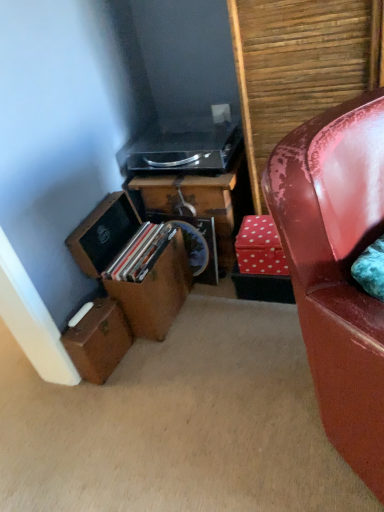
The image size is (384, 512). In order to click on shiny red leather chair at right in this screenshot , I will do `click(337, 268)`.

I want to click on black plastic stereo at upper center, so click(x=183, y=148).

This screenshot has width=384, height=512. Describe the element at coordinates (260, 247) in the screenshot. I see `red polka dot cardboard box at center` at that location.

Measure the distance between point (259, 259) and camera.

They are 5.11 feet apart.

I want to click on shiny red leather chair at right, so click(337, 268).

Locate an element on the screen. chair on the right side of red polka dot cardboard box at center is located at coordinates (337, 268).

Is red polka dot cardboard box at center located within shiny red leather chair at right?

No, red polka dot cardboard box at center is not a part of shiny red leather chair at right.

Does shiny red leather chair at right appear on the left side of red polka dot cardboard box at center?

No, shiny red leather chair at right is not to the left of red polka dot cardboard box at center.

From the image's perspective, does shiny red leather chair at right appear lower than red polka dot cardboard box at center?

Yes.

From a real-world perspective, between black plastic stereo at upper center and red polka dot cardboard box at center, who is vertically higher?

black plastic stereo at upper center is physically above.

Is black plastic stereo at upper center further to camera compared to red polka dot cardboard box at center?

That is True.

From the picture: In the image, is black plastic stereo at upper center on the left side or the right side of red polka dot cardboard box at center?

Clearly, black plastic stereo at upper center is on the left of red polka dot cardboard box at center in the image.

Locate an element on the screen. This screenshot has width=384, height=512. the 2nd box positioned below the black plastic stereo at upper center (from a real-world perspective) is located at coordinates (98, 341).

Is black plastic stereo at upper center located within brown leather suitcase at lower left, acting as the second box starting from the top?

Actually, black plastic stereo at upper center is outside brown leather suitcase at lower left, acting as the second box starting from the top.

Can you confirm if brown leather suitcase at lower left, placed as the first box when sorted from bottom to top, is smaller than black plastic stereo at upper center?

Indeed, brown leather suitcase at lower left, placed as the first box when sorted from bottom to top, has a smaller size compared to black plastic stereo at upper center.

Looking at this image, could you tell me if brown leather suitcase at lower left, placed as the first box when sorted from bottom to top, is turned towards black plastic stereo at upper center?

No, brown leather suitcase at lower left, placed as the first box when sorted from bottom to top, is not turned towards black plastic stereo at upper center.

From a real-world perspective, between wooden box at lower left, the second box positioned from the bottom, and brown leather suitcase at lower left, acting as the second box starting from the top, who is vertically lower?

brown leather suitcase at lower left, acting as the second box starting from the top, from a real-world perspective.

From the picture: Can you confirm if wooden box at lower left, the first box in the top-to-bottom sequence, is smaller than brown leather suitcase at lower left, acting as the second box starting from the top?

Actually, wooden box at lower left, the first box in the top-to-bottom sequence, might be larger than brown leather suitcase at lower left, acting as the second box starting from the top.

From the image's perspective, is wooden box at lower left, the first box in the top-to-bottom sequence, located beneath brown leather suitcase at lower left, placed as the first box when sorted from bottom to top?

No.

Can you tell me how much brown leather suitcase at lower left, placed as the first box when sorted from bottom to top, and wooden box at lower left, the second box positioned from the bottom, differ in facing direction?

They differ by 3.14 degrees in their facing directions.

Could you tell me if brown leather suitcase at lower left, placed as the first box when sorted from bottom to top, is turned towards wooden box at lower left, the first box in the top-to-bottom sequence?

No, brown leather suitcase at lower left, placed as the first box when sorted from bottom to top, does not turn towards wooden box at lower left, the first box in the top-to-bottom sequence.

Looking at this image, does brown leather suitcase at lower left, acting as the second box starting from the top, have a greater height compared to wooden box at lower left, the second box positioned from the bottom?

In fact, brown leather suitcase at lower left, acting as the second box starting from the top, may be shorter than wooden box at lower left, the second box positioned from the bottom.

Considering the sizes of objects wooden box at lower left, the second box positioned from the bottom, and shiny red leather chair at right in the image provided, who is wider, wooden box at lower left, the second box positioned from the bottom, or shiny red leather chair at right?

With larger width is shiny red leather chair at right.

From the image's perspective, is wooden box at lower left, the first box in the top-to-bottom sequence, located above or below shiny red leather chair at right?

Clearly, from the image's perspective, wooden box at lower left, the first box in the top-to-bottom sequence, is above shiny red leather chair at right.

Which object is positioned more to the right, wooden box at lower left, the first box in the top-to-bottom sequence, or shiny red leather chair at right?

From the viewer's perspective, shiny red leather chair at right appears more on the right side.

Is black plastic stereo at upper center aimed at brown leather suitcase at lower left, acting as the second box starting from the top?

No, black plastic stereo at upper center is not oriented towards brown leather suitcase at lower left, acting as the second box starting from the top.

Based on their positions, is black plastic stereo at upper center located to the left or right of brown leather suitcase at lower left, acting as the second box starting from the top?

black plastic stereo at upper center is positioned on brown leather suitcase at lower left, acting as the second box starting from the top,'s right side.

From a real-world perspective, which object rests below the other?

brown leather suitcase at lower left, acting as the second box starting from the top, from a real-world perspective.

Which is closer to the camera, (142, 152) or (104, 298)?

Positioned in front is point (104, 298).

The image size is (384, 512). Identify the location of cardboard box located above the shiny red leather chair at right (from the image's perspective). [260, 247].

The width and height of the screenshot is (384, 512). Identify the location of stereo located behind the red polka dot cardboard box at center. (183, 148).

From the image, which object appears to be nearer to red polka dot cardboard box at center, brown leather suitcase at lower left, acting as the second box starting from the top, or shiny red leather chair at right?

The object closer to red polka dot cardboard box at center is brown leather suitcase at lower left, acting as the second box starting from the top.

Which object lies nearer to the anchor point black plastic stereo at upper center, wooden desk at center or shiny red leather chair at right?

wooden desk at center lies closer to black plastic stereo at upper center than the other object.

Estimate the real-world distances between objects in this image. Which object is further from brown leather suitcase at lower left, placed as the first box when sorted from bottom to top, wooden desk at center or red polka dot cardboard box at center?

red polka dot cardboard box at center.

In the scene shown: Estimate the real-world distances between objects in this image. Which object is further from black plastic stereo at upper center, brown leather suitcase at lower left, placed as the first box when sorted from bottom to top, or red polka dot cardboard box at center?

Based on the image, brown leather suitcase at lower left, placed as the first box when sorted from bottom to top, appears to be further to black plastic stereo at upper center.

Which object lies nearer to the anchor point red polka dot cardboard box at center, black plastic stereo at upper center or wooden desk at center?

wooden desk at center.

Looking at this image, estimate the real-world distances between objects in this image. Which object is closer to black plastic stereo at upper center, brown leather suitcase at lower left, acting as the second box starting from the top, or wooden box at lower left, the second box positioned from the bottom?

wooden box at lower left, the second box positioned from the bottom, is positioned closer to the anchor black plastic stereo at upper center.

Looking at the image, which one is located closer to black plastic stereo at upper center, wooden desk at center or brown leather suitcase at lower left, acting as the second box starting from the top?

wooden desk at center.

Considering their positions, is shiny red leather chair at right positioned further to wooden desk at center than wooden box at lower left, the first box in the top-to-bottom sequence?

shiny red leather chair at right.

You are a GUI agent. You are given a task and a screenshot of the screen. Output one action in this format:
    pyautogui.click(x=<x>, y=<y>)
    Task: Click on the desk between wooden box at lower left, the first box in the top-to-bottom sequence, and red polka dot cardboard box at center from left to right
    
    Given the screenshot: What is the action you would take?
    pyautogui.click(x=194, y=203)

Where is `cardboard box between shiny red leather chair at right and black plastic stereo at upper center in the front-back direction`? cardboard box between shiny red leather chair at right and black plastic stereo at upper center in the front-back direction is located at coordinates (260, 247).

Where is `desk between black plastic stereo at upper center and brown leather suitcase at lower left, acting as the second box starting from the top, vertically`? desk between black plastic stereo at upper center and brown leather suitcase at lower left, acting as the second box starting from the top, vertically is located at coordinates (194, 203).

Locate an element on the screen. The height and width of the screenshot is (512, 384). box between shiny red leather chair at right and brown leather suitcase at lower left, placed as the first box when sorted from bottom to top, from front to back is located at coordinates [x=155, y=293].